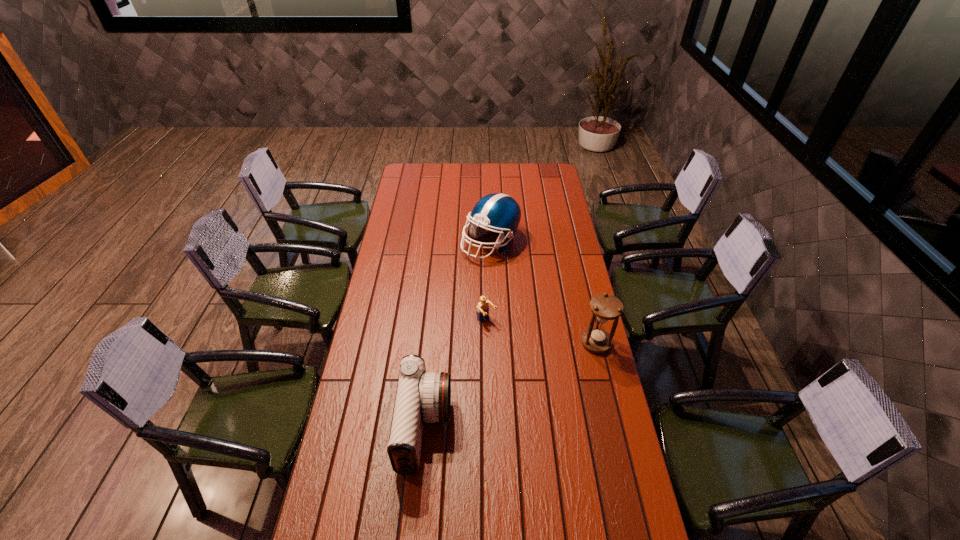
I want to click on vacant space situated on the face of the shortest object, so click(538, 372).

Locate an element on the screen. This screenshot has height=540, width=960. free space located on the face of the shortest object is located at coordinates (543, 377).

Find the location of `blank area located at the front of the farthest object with the faceguard`. blank area located at the front of the farthest object with the faceguard is located at coordinates (495, 319).

Identify the location of vacant space positioned 0.310m at the front of the farthest object with the faceguard. (495, 315).

Identify the location of vacant region located at the front of the farthest object with the faceguard. (x=494, y=294).

Where is `object located in the right edge section of the desktop`? This screenshot has width=960, height=540. object located in the right edge section of the desktop is located at coordinates (606, 307).

Locate an element on the screen. vacant space at the far edge of the desktop is located at coordinates (511, 172).

Find the location of a particular element. This screenshot has width=960, height=540. vacant space at the left edge is located at coordinates point(387,289).

This screenshot has width=960, height=540. Identify the location of vacant space at the right edge of the desktop. 549,248.

Image resolution: width=960 pixels, height=540 pixels. I want to click on free space at the far left corner of the desktop, so click(411, 163).